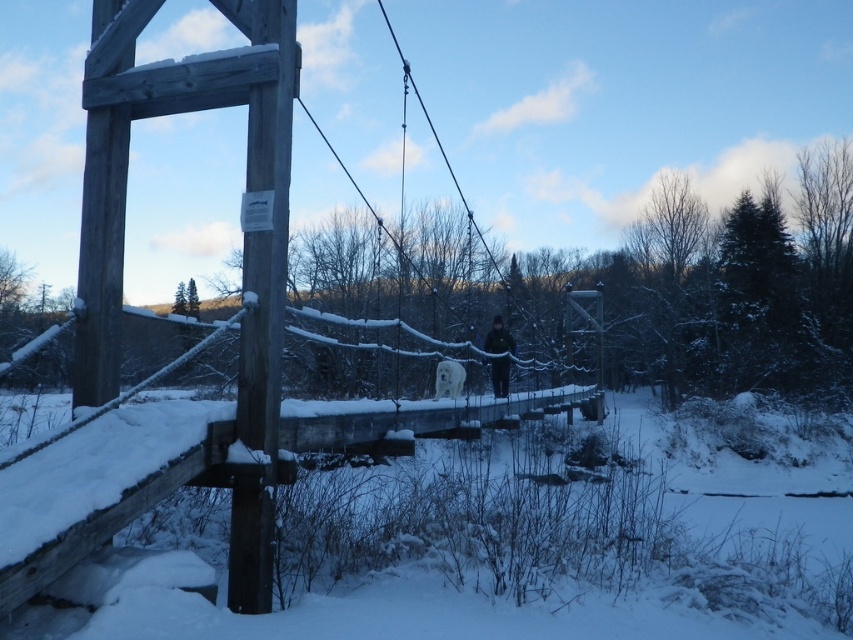
Question: Is wooden suspension bridge at center above dark brown jacket at center?

Choices:
 (A) yes
 (B) no

Answer: (A)

Question: Does wooden suspension bridge at center have a lesser width compared to dark brown jacket at center?

Choices:
 (A) yes
 (B) no

Answer: (A)

Question: Is wooden suspension bridge at center above dark brown jacket at center?

Choices:
 (A) no
 (B) yes

Answer: (B)

Question: Which object is farther from the camera taking this photo?

Choices:
 (A) dark brown jacket at center
 (B) wooden suspension bridge at center

Answer: (A)